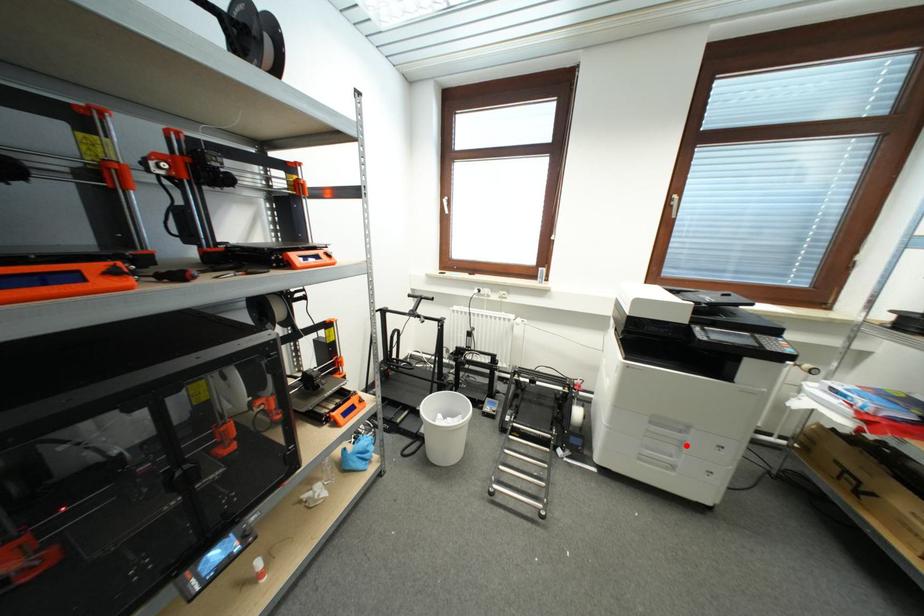
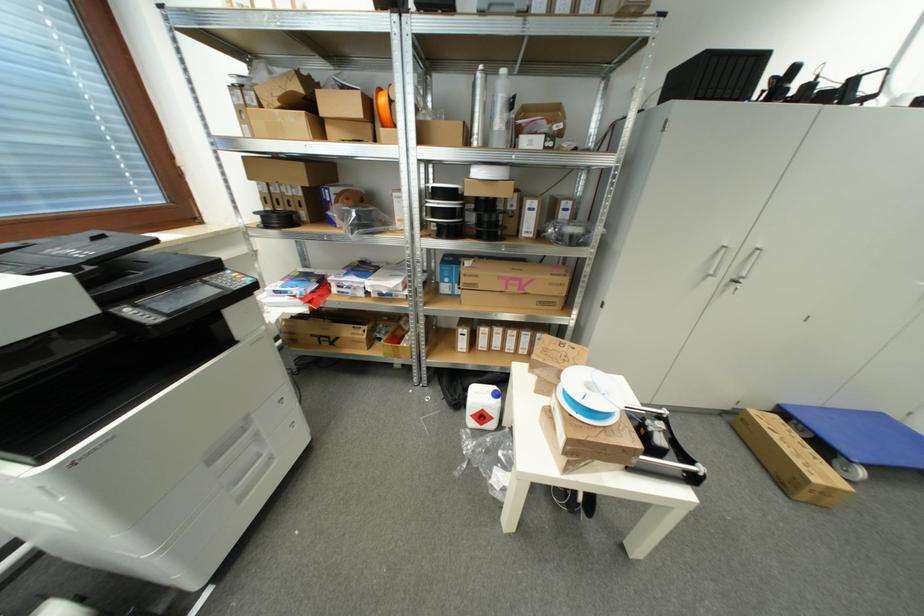
Question: I am providing you with two images of the same scene from different viewpoints. In image1, a red point is highlighted. Considering the same 3D point in image2, which of the following is correct?

Choices:
 (A) It is closer
 (B) It is farther

Answer: (A)